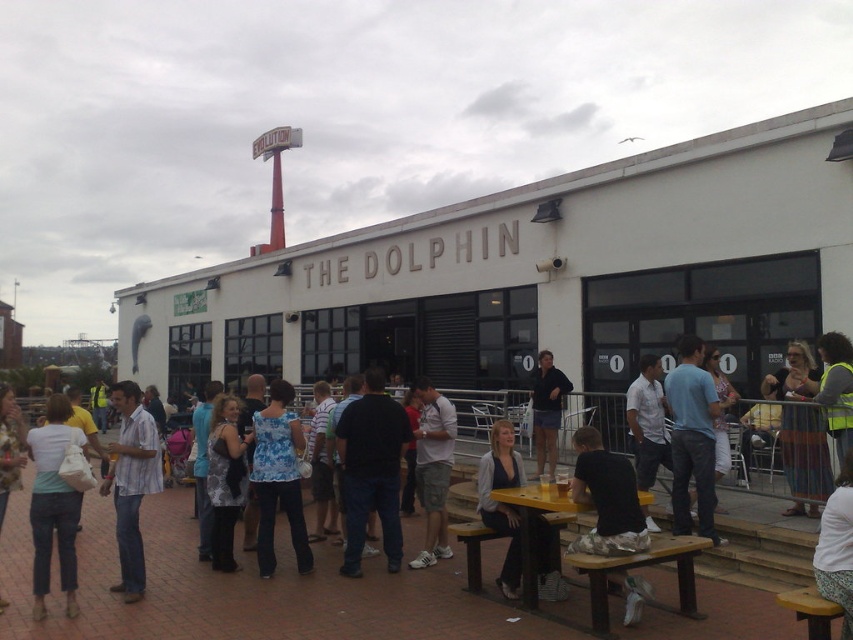
Between light blue denim shorts at center and matte black shirt at center, which one is positioned lower?

light blue denim shorts at center

Can you confirm if light blue denim shorts at center is bigger than matte black shirt at center?

No, light blue denim shorts at center is not bigger than matte black shirt at center.

Image resolution: width=853 pixels, height=640 pixels. Find the location of `light blue denim shorts at center`. light blue denim shorts at center is located at coordinates (433, 468).

Who is more forward, (132, 401) or (12, 456)?

Positioned in front is point (12, 456).

Does point (144, 493) lie in front of point (4, 433)?

No, (144, 493) is further to viewer.

You are a GUI agent. You are given a task and a screenshot of the screen. Output one action in this format:
    pyautogui.click(x=<x>, y=<y>)
    Task: Click on the striped cotton shirt at center
    The image size is (853, 640).
    Given the screenshot: What is the action you would take?
    pyautogui.click(x=131, y=483)

At what (x,y) coordinates should I click in order to perform the action: click on striped cotton shirt at center. Please return your answer as a coordinate pair (x, y). Looking at the image, I should click on (131, 483).

Is matte black jacket at lower center taller than white fabric skirt at lower right?

Yes, matte black jacket at lower center is taller than white fabric skirt at lower right.

Between matte black jacket at lower center and white fabric skirt at lower right, which one appears on the left side from the viewer's perspective?

Positioned to the left is matte black jacket at lower center.

Does point (548, 573) come in front of point (849, 541)?

That is False.

The height and width of the screenshot is (640, 853). I want to click on matte black jacket at lower center, so click(502, 502).